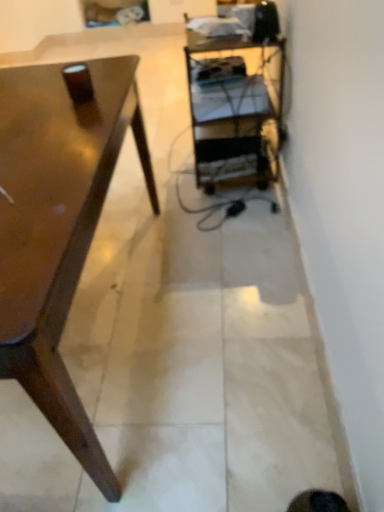
Where is `vacant area that lies in front of metallic silver shelf at center`? The image size is (384, 512). vacant area that lies in front of metallic silver shelf at center is located at coordinates (215, 220).